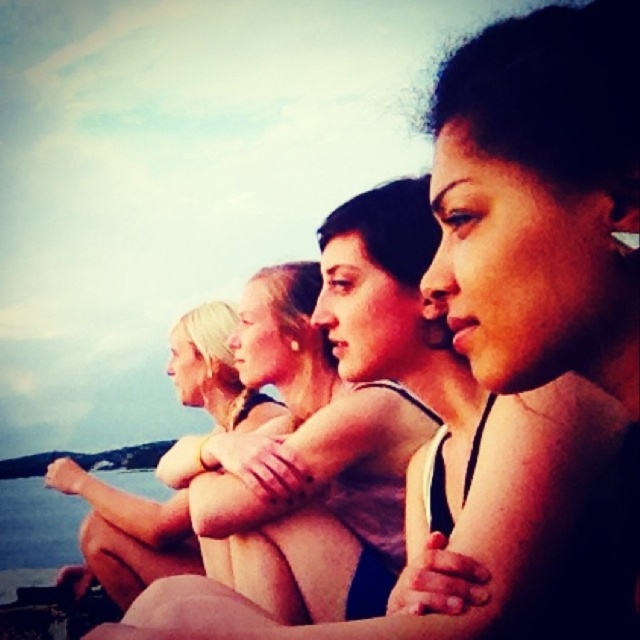
Question: Is blonde hair at center smaller than transparent water at lower left?

Choices:
 (A) no
 (B) yes

Answer: (B)

Question: Among these objects, which one is farthest from the camera?

Choices:
 (A) transparent water at lower left
 (B) blonde hair at center

Answer: (A)

Question: Does blonde hair at center lie behind transparent water at lower left?

Choices:
 (A) yes
 (B) no

Answer: (B)

Question: Does blonde hair at center come in front of transparent water at lower left?

Choices:
 (A) no
 (B) yes

Answer: (B)